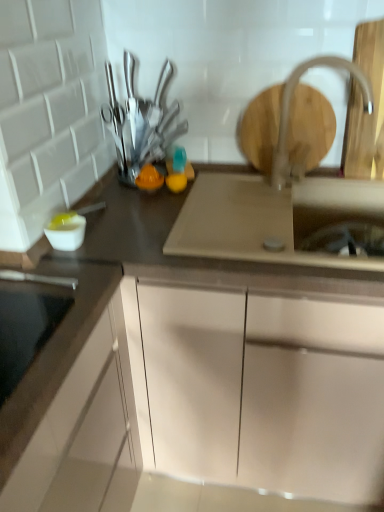
Find the location of `vacant area to the left of satin nickel faucet at upper right`. vacant area to the left of satin nickel faucet at upper right is located at coordinates (251, 194).